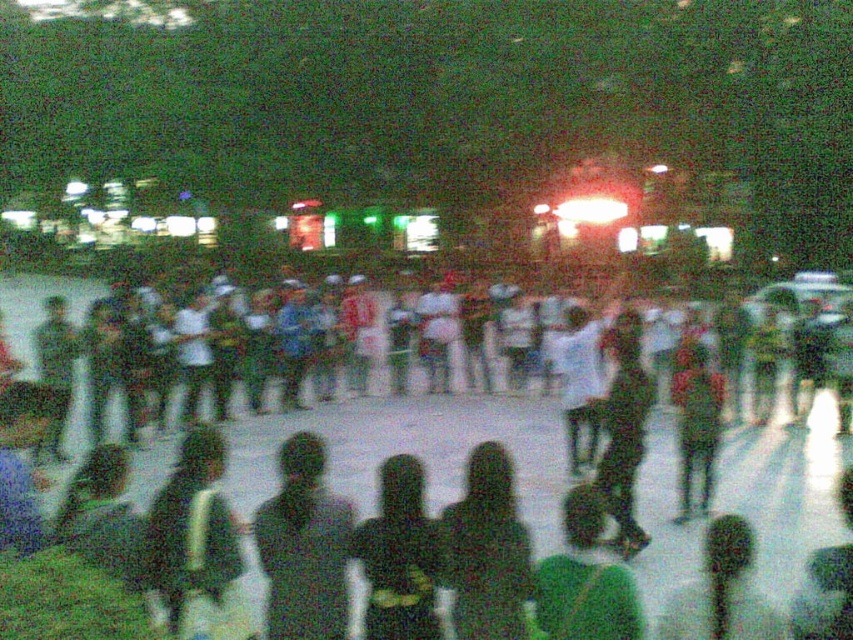
Question: Considering the real-world distances, which object is closest to the green fabric umbrella at lower right?

Choices:
 (A) green fabric shirt at center
 (B) green fabric jacket at center
 (C) black matte shirt at center
 (D) dark green fabric at center

Answer: (A)

Question: Is green fabric shirt at center thinner than green fabric jacket at center?

Choices:
 (A) no
 (B) yes

Answer: (B)

Question: Among these objects, which one is farthest from the camera?

Choices:
 (A) black matte shirt at center
 (B) green fabric umbrella at lower right
 (C) white glossy pavement at center

Answer: (C)

Question: Can you confirm if black matte shirt at center is bigger than green fabric umbrella at lower right?

Choices:
 (A) yes
 (B) no

Answer: (B)

Question: Is dark green fabric at center smaller than black matte shirt at center?

Choices:
 (A) no
 (B) yes

Answer: (A)

Question: Which point appears closest to the camera in this image?

Choices:
 (A) (688, 369)
 (B) (482, 531)
 (C) (670, 618)
 (D) (817, 490)

Answer: (B)